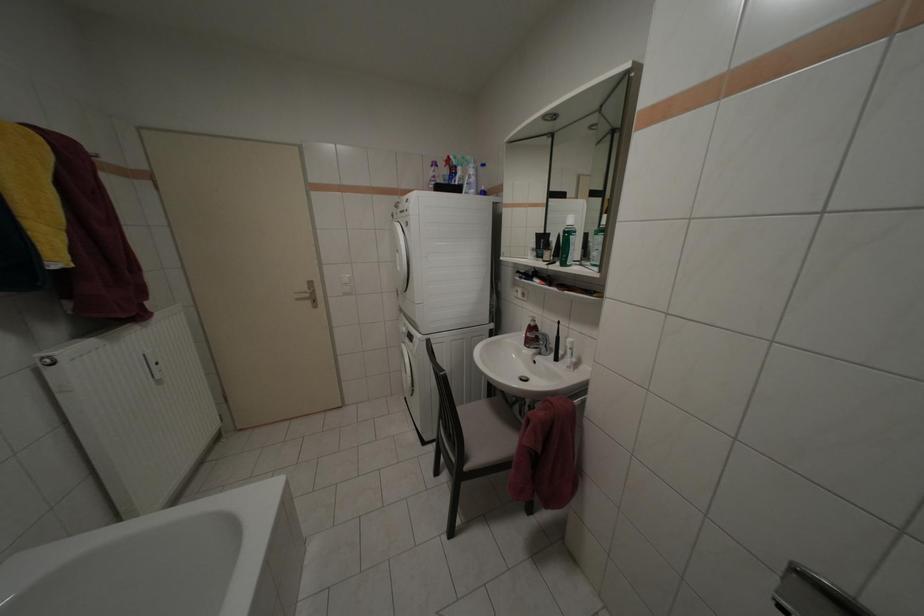
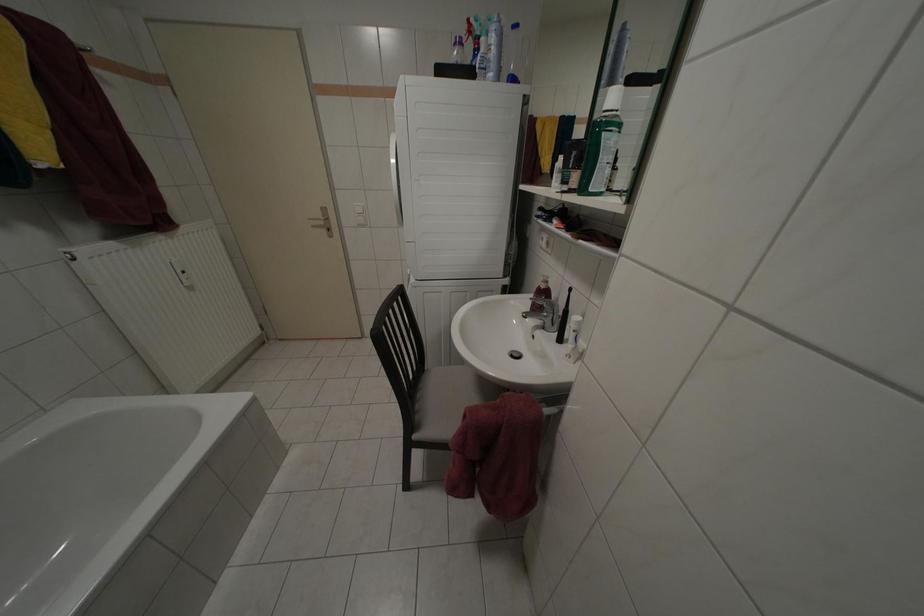
Question: The camera is either moving clockwise (left) or counter-clockwise (right) around the object. The first image is from the beginning of the video and the second image is from the end. Is the camera moving left or right when shooting the video?

Choices:
 (A) Left
 (B) Right

Answer: (B)